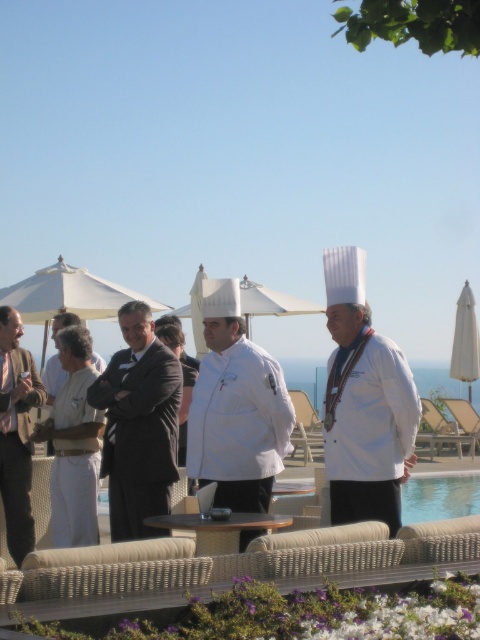
Which is more to the right, smokey gray suit at center or white chef's coat at left?

Positioned to the right is smokey gray suit at center.

Who is higher up, smokey gray suit at center or white chef's coat at left?

smokey gray suit at center

Locate an element on the screen. smokey gray suit at center is located at coordinates (x=139, y=426).

Is point (28, 497) positioned in front of point (56, 394)?

That is True.

Between point (28, 365) and point (54, 324), which one is positioned behind?

Positioned behind is point (54, 324).

Between point (22, 417) and point (100, 369), which one is positioned behind?

Point (100, 369)

You are a GUI agent. You are given a task and a screenshot of the screen. Output one action in this format:
    pyautogui.click(x=<x>, y=<y>)
    Task: Click on the white chef's coat at left
    
    Given the screenshot: What is the action you would take?
    pyautogui.click(x=16, y=433)

Which of these two, white matte chef coat at center or white chef's coat at left, stands taller?

With more height is white chef's coat at left.

Does white matte chef coat at center have a larger size compared to white chef's coat at left?

Indeed, white matte chef coat at center has a larger size compared to white chef's coat at left.

Locate an element on the screen. The image size is (480, 640). white matte chef coat at center is located at coordinates (236, 408).

Where is `white matte chef coat at center`? The width and height of the screenshot is (480, 640). white matte chef coat at center is located at coordinates [x=236, y=408].